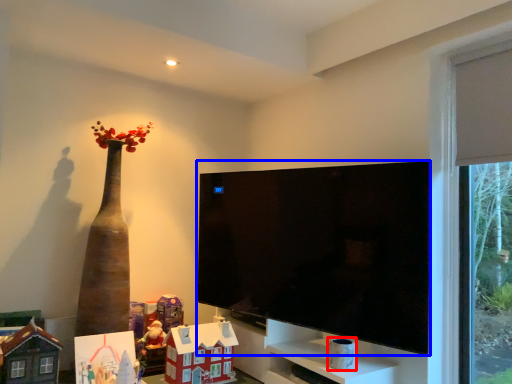
Question: Which point is further to the camera, toy (highlighted by a red box) or television (highlighted by a blue box)?

Choices:
 (A) toy
 (B) television

Answer: (A)